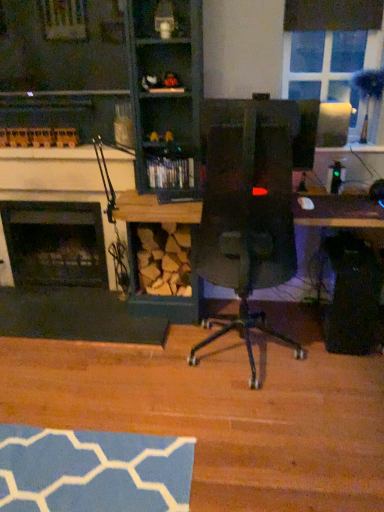
Question: From a real-world perspective, is black matte fireplace at left, the 1th fireplace from the back, on wooden fireplace at left?

Choices:
 (A) no
 (B) yes

Answer: (A)

Question: Could you tell me if black matte fireplace at left, marked as the 2th fireplace in a front-to-back arrangement, is facing wooden fireplace at left?

Choices:
 (A) no
 (B) yes

Answer: (B)

Question: Is black matte fireplace at left, marked as the 2th fireplace in a front-to-back arrangement, closer to the viewer compared to wooden fireplace at left?

Choices:
 (A) yes
 (B) no

Answer: (B)

Question: From the image's perspective, is black matte fireplace at left, marked as the 2th fireplace in a front-to-back arrangement, beneath wooden fireplace at left?

Choices:
 (A) no
 (B) yes

Answer: (B)

Question: Is black matte fireplace at left, the 1th fireplace from the back, taller than wooden fireplace at left?

Choices:
 (A) yes
 (B) no

Answer: (B)

Question: Considering the positions of point (147, 17) and point (6, 211), is point (147, 17) closer or farther from the camera than point (6, 211)?

Choices:
 (A) closer
 (B) farther

Answer: (A)

Question: Based on their sizes in the image, would you say wooden shelf at upper center, the first shelf viewed from the top, is bigger or smaller than black matte fireplace at left, the 1th fireplace from the back?

Choices:
 (A) big
 (B) small

Answer: (B)

Question: From a real-world perspective, is wooden shelf at upper center, the 1th shelf in the front-to-back sequence, positioned above or below black matte fireplace at left, marked as the 2th fireplace in a front-to-back arrangement?

Choices:
 (A) below
 (B) above

Answer: (B)

Question: Considering the positions of wooden shelf at upper center, the 2th shelf viewed from the back, and black matte fireplace at left, marked as the 2th fireplace in a front-to-back arrangement, in the image, is wooden shelf at upper center, the 2th shelf viewed from the back, taller or shorter than black matte fireplace at left, marked as the 2th fireplace in a front-to-back arrangement,?

Choices:
 (A) short
 (B) tall

Answer: (A)

Question: Does point (367, 52) appear closer or farther from the camera than point (130, 157)?

Choices:
 (A) closer
 (B) farther

Answer: (B)

Question: In terms of height, does clear glass window at upper right look taller or shorter compared to black glass fireplace at left, positioned as the 2th fireplace in back-to-front order?

Choices:
 (A) short
 (B) tall

Answer: (A)

Question: From the image's perspective, is clear glass window at upper right above or below black glass fireplace at left, which appears as the first fireplace when viewed from the front?

Choices:
 (A) above
 (B) below

Answer: (A)

Question: Is clear glass window at upper right inside or outside of black glass fireplace at left, positioned as the 2th fireplace in back-to-front order?

Choices:
 (A) outside
 (B) inside

Answer: (A)

Question: Considering the positions of point (92, 256) and point (142, 18), is point (92, 256) closer or farther from the camera than point (142, 18)?

Choices:
 (A) farther
 (B) closer

Answer: (A)

Question: From the image's perspective, is black matte fireplace at left, the 1th fireplace from the back, above or below wooden shelf at upper center, the first shelf viewed from the top?

Choices:
 (A) below
 (B) above

Answer: (A)